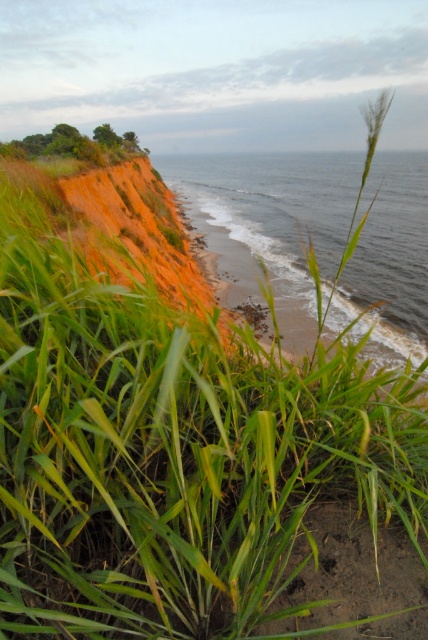
Based on the photo, you are standing on the beach and want to walk to the blue water at center. There is green grass at upper left in your way. Which direction should you go to avoid the grass?

To avoid the green grass at upper left, you should walk towards the right side since the blue water at center is wider than the green grass at upper left.